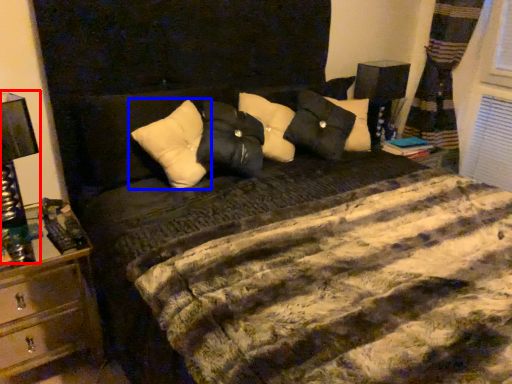
Question: Among these objects, which one is nearest to the camera, bedside lamp (highlighted by a red box) or pillow (highlighted by a blue box)?

Choices:
 (A) bedside lamp
 (B) pillow

Answer: (A)